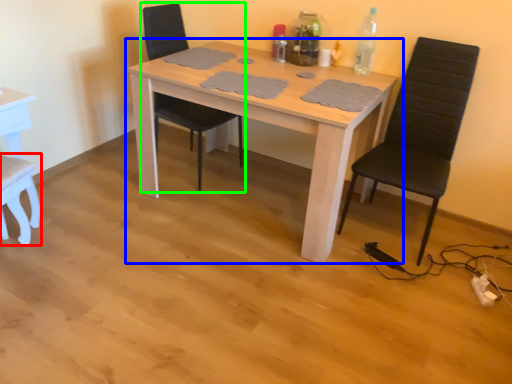
Question: Which object is the closest to the chair (highlighted by a red box)? Choose among these: table (highlighted by a blue box) or chair (highlighted by a green box).

Choices:
 (A) table
 (B) chair

Answer: (B)